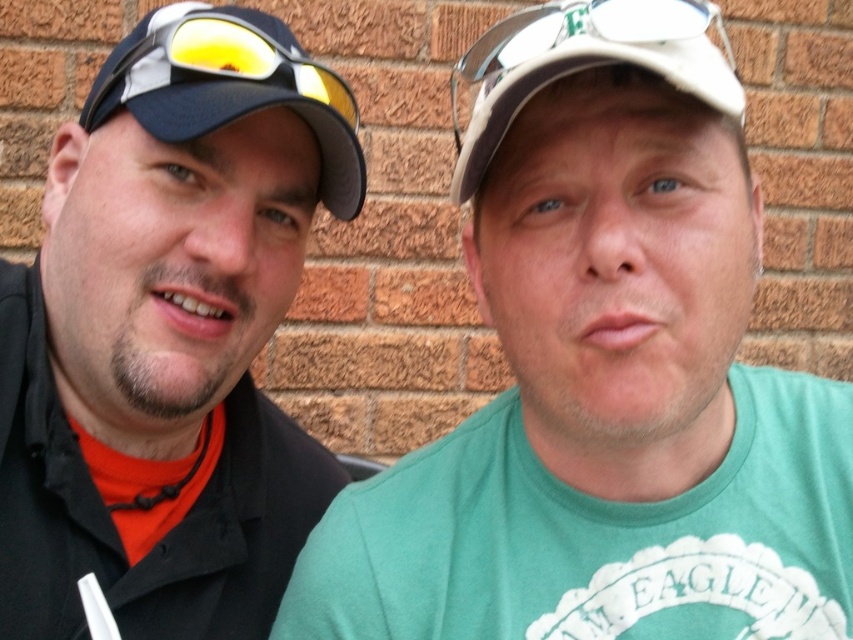
Question: Among these objects, which one is farthest from the camera?

Choices:
 (A) black matte cap at left
 (B) white matte cap at center

Answer: (A)

Question: Which of the following is the farthest from the observer?

Choices:
 (A) black matte cap at left
 (B) green fabric shirt at center
 (C) white matte cap at center
 (D) matte black cap at left

Answer: (A)

Question: Which point is closer to the camera?

Choices:
 (A) (653, 388)
 (B) (70, 157)
 (C) (335, 177)
 (D) (669, 81)

Answer: (D)

Question: Is matte black cap at left wider than white matte cap at center?

Choices:
 (A) yes
 (B) no

Answer: (B)

Question: Does black matte cap at left appear under matte black cap at left?

Choices:
 (A) yes
 (B) no

Answer: (A)

Question: Is black matte cap at left closer to camera compared to white matte cap at center?

Choices:
 (A) no
 (B) yes

Answer: (A)